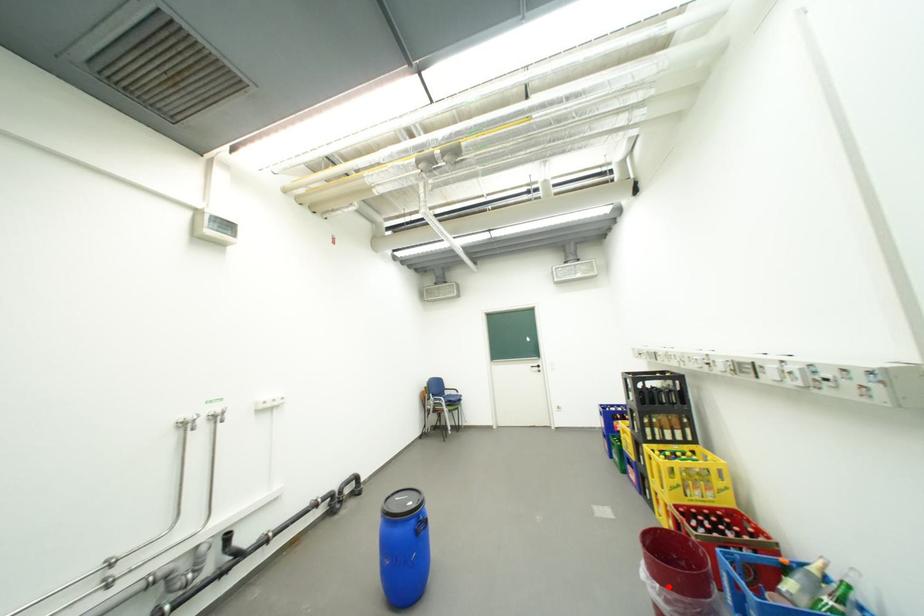
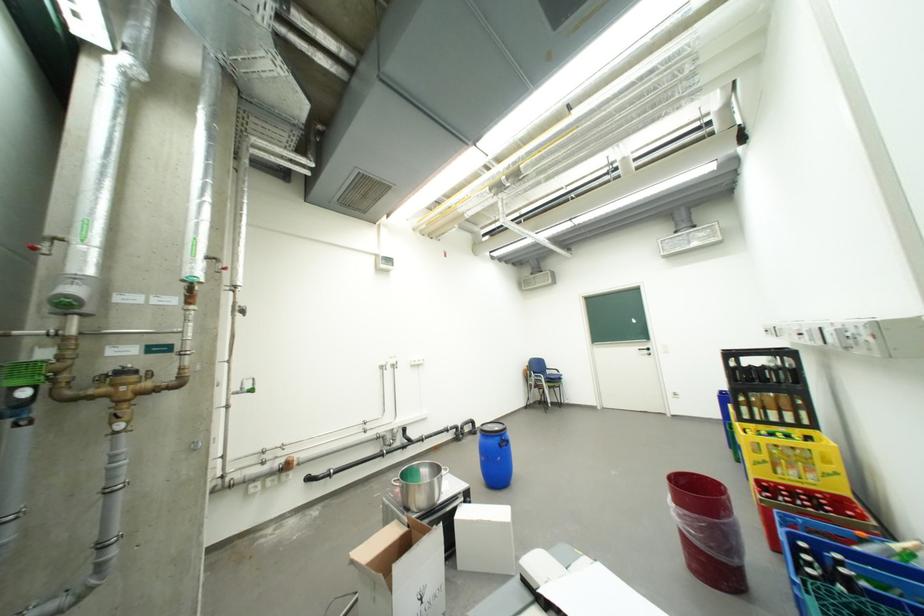
Find the pixel in the second image that matches the highlighted location in the first image.

(685, 507)